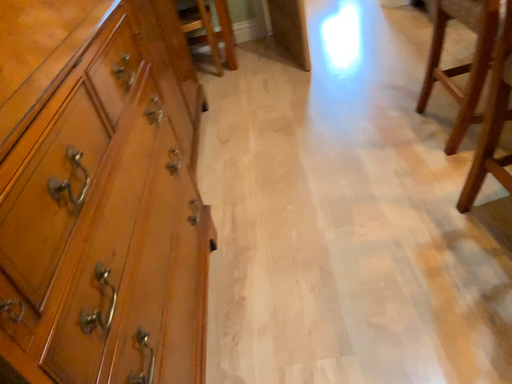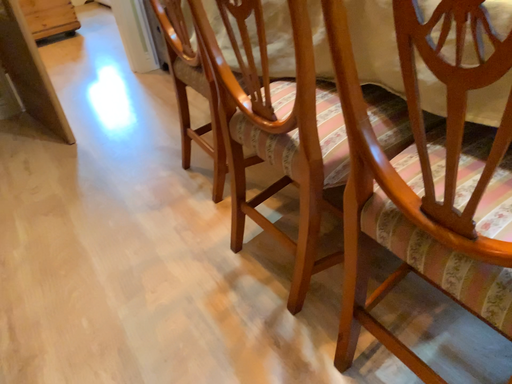
Question: Which way did the camera rotate in the video?

Choices:
 (A) rotated downward
 (B) rotated upward

Answer: (B)